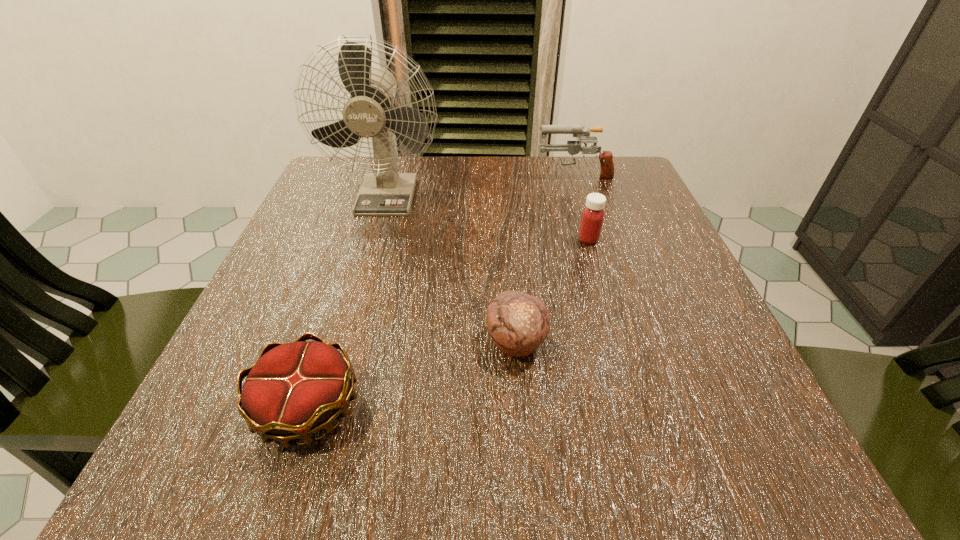
Where is `free space in the image that satisfies the following two spatial constraints: 1. on the air flow direction of the medicine; 2. on the right side of the tallest object`? This screenshot has width=960, height=540. free space in the image that satisfies the following two spatial constraints: 1. on the air flow direction of the medicine; 2. on the right side of the tallest object is located at coordinates (374, 239).

The width and height of the screenshot is (960, 540). I want to click on free space that satisfies the following two spatial constraints: 1. on the back side of the crown; 2. on the right side of the muffin, so click(328, 342).

Find the location of `vacant space that satisfies the following two spatial constraints: 1. at the barrel end of the gun; 2. on the air flow direction of the tallest object`. vacant space that satisfies the following two spatial constraints: 1. at the barrel end of the gun; 2. on the air flow direction of the tallest object is located at coordinates (580, 194).